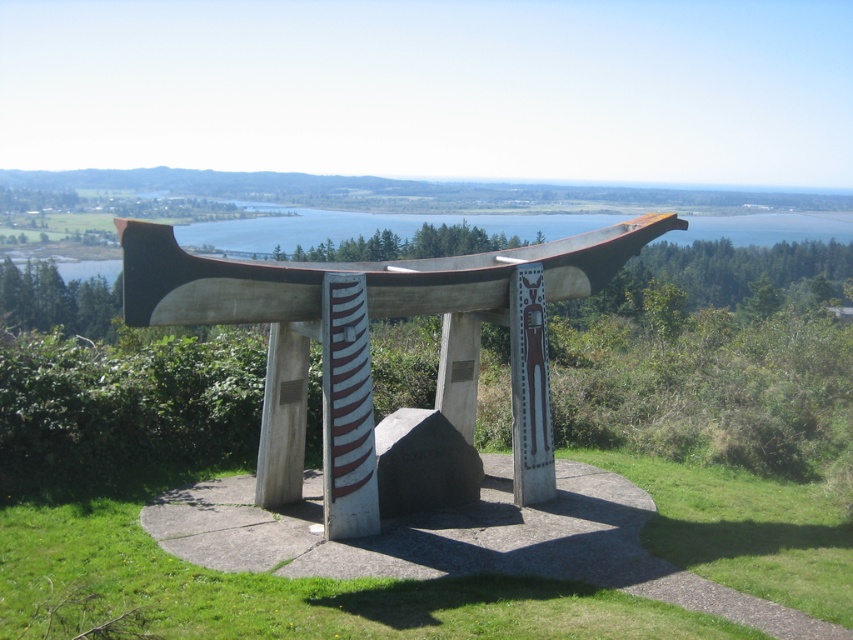
Question: Is green grass at center to the right of polished wood bench at center from the viewer's perspective?

Choices:
 (A) yes
 (B) no

Answer: (A)

Question: Is green grass at center smaller than polished wood bench at center?

Choices:
 (A) yes
 (B) no

Answer: (A)

Question: Which point appears farthest from the camera in this image?

Choices:
 (A) (164, 244)
 (B) (421, 609)

Answer: (A)

Question: Among these objects, which one is farthest from the camera?

Choices:
 (A) green grass at center
 (B) polished wood bench at center

Answer: (B)

Question: Does green grass at center appear over polished wood bench at center?

Choices:
 (A) yes
 (B) no

Answer: (B)